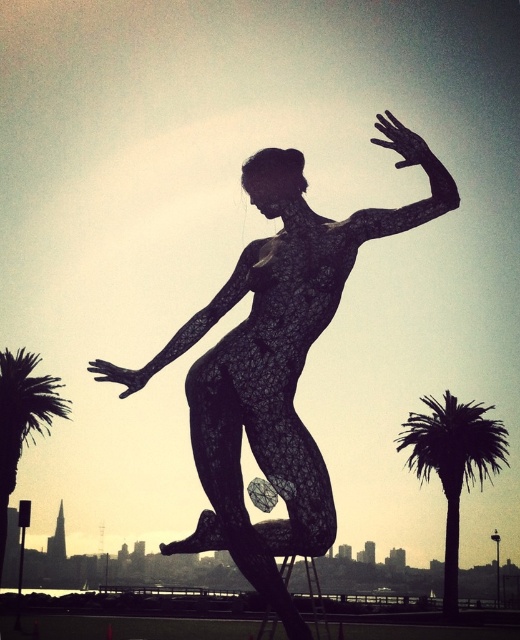
Can you confirm if black wireframe figure at center is positioned to the right of green leafy palm tree at right?

Incorrect, black wireframe figure at center is not on the right side of green leafy palm tree at right.

Measure the distance from black wireframe figure at center to green leafy palm tree at right.

black wireframe figure at center and green leafy palm tree at right are 46.81 meters apart from each other.

Measure the distance between black wireframe figure at center and camera.

black wireframe figure at center is 17.22 meters away from camera.

At what (x,y) coordinates should I click in order to perform the action: click on black wireframe figure at center. Please return your answer as a coordinate pair (x, y). The width and height of the screenshot is (520, 640). Looking at the image, I should click on (276, 364).

Does point (474, 432) lie in front of point (50, 376)?

Yes.

Locate an element on the screen. green leafy palm tree at right is located at coordinates (453, 464).

Who is shorter, black wireframe figure at center or green leafy palm tree at left?

black wireframe figure at center

Is point (280, 156) more distant than point (19, 376)?

No.

Identify the location of black wireframe figure at center. coord(276,364).